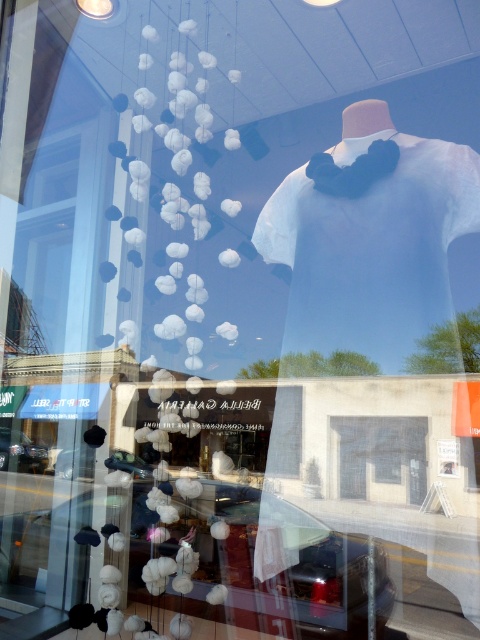
Can you confirm if white matte t-shirt at center is positioned above metallic silver car at lower center?

Yes, white matte t-shirt at center is above metallic silver car at lower center.

Who is more forward, (x=277, y=243) or (x=148, y=464)?

Point (x=148, y=464) is in front.

Find the location of `white matte t-shirt at center`. white matte t-shirt at center is located at coordinates (370, 241).

Between shiny black car at lower center and white matte t-shirt at center, which one appears on the right side from the viewer's perspective?

white matte t-shirt at center

Which is in front, point (192, 544) or point (348, 154)?

Positioned in front is point (348, 154).

Looking at this image, measure the distance between point (225,624) and camera.

Point (225,624) is 2.76 meters from camera.

Where is `shiny black car at lower center`? The image size is (480, 640). shiny black car at lower center is located at coordinates coord(191,566).

I want to click on white matte t-shirt at center, so click(370, 241).

Is white matte t-shirt at center bigger than shiny black car at lower left?

Correct, white matte t-shirt at center is larger in size than shiny black car at lower left.

What do you see at coordinates (370, 241) in the screenshot? I see `white matte t-shirt at center` at bounding box center [370, 241].

Where is `white matte t-shirt at center`? The width and height of the screenshot is (480, 640). white matte t-shirt at center is located at coordinates (370, 241).